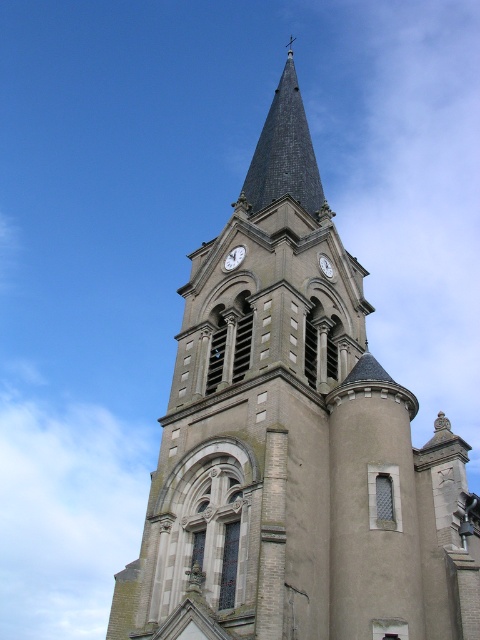
Is smooth stone clock tower at center to the left of white stone clock at upper center from the viewer's perspective?

Correct, you'll find smooth stone clock tower at center to the left of white stone clock at upper center.

At what (x,y) coordinates should I click in order to perform the action: click on smooth stone clock tower at center. Please return your answer as a coordinate pair (x, y). Image resolution: width=480 pixels, height=640 pixels. Looking at the image, I should click on (295, 444).

Can you confirm if white stone clock at upper center is positioned to the right of white metallic clock at center?

In fact, white stone clock at upper center is to the left of white metallic clock at center.

Which is more to the right, white stone clock at upper center or white metallic clock at center?

white metallic clock at center is more to the right.

Between point (238, 253) and point (326, 276), which one is positioned in front?

Point (326, 276) is more forward.

What are the coordinates of `white stone clock at upper center` in the screenshot? It's located at (233, 257).

Which is more to the right, smooth stone clock tower at center or white metallic clock at center?

white metallic clock at center is more to the right.

Is point (202, 424) positioned in front of point (328, 275)?

Yes, it is in front of point (328, 275).

Which is in front, point (241, 285) or point (332, 268)?

Point (241, 285)

Find the location of a particular element. This screenshot has width=480, height=640. smooth stone clock tower at center is located at coordinates (295, 444).